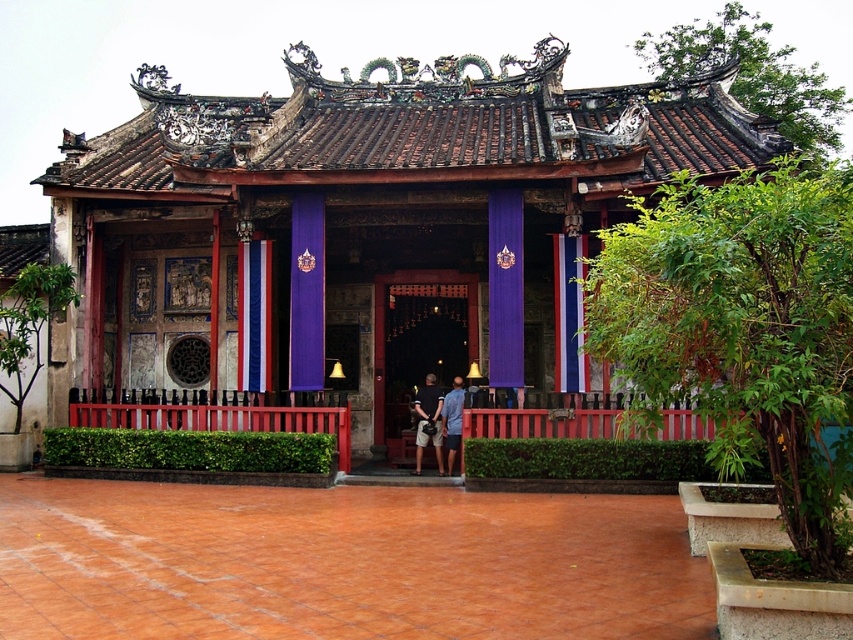
From the picture: You are a visitor standing in front of the traditional East Asian building. You notice a polished wood door at center and a matte gray shirt at center. Which object is taller?

The polished wood door at center is much taller than the matte gray shirt at center.

You are standing in front of the traditional East Asian building and see the point marked at coordinates (419, 337). Based on the scene description, which object from the list is this point located on?

The point is located on the polished wood door at center.

You are standing in front of the traditional East Asian architectural structure depicted in the scene. There is a point marked at coordinates (419, 337). What object is located at this point?

The point at coordinates (419, 337) corresponds to the polished wood door at center.